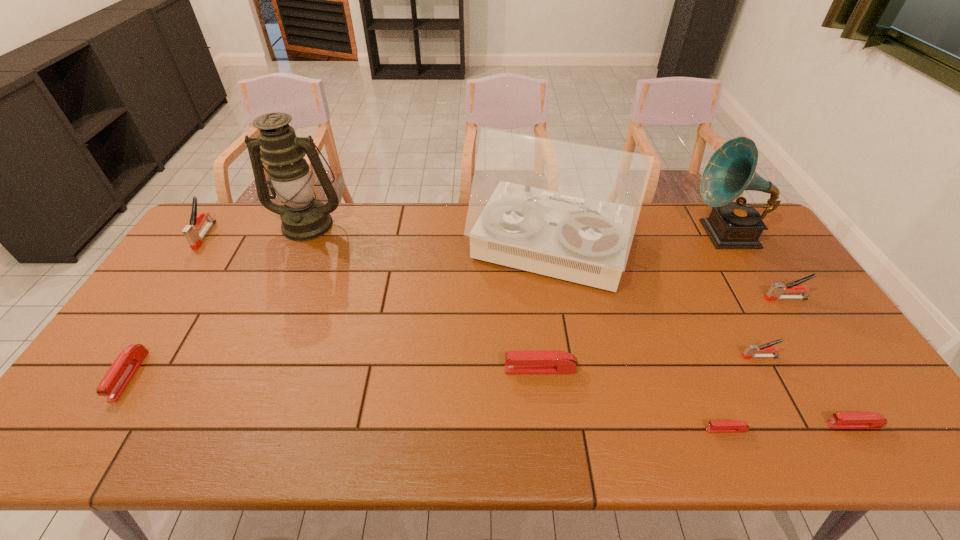
Where is `free region located 0.150m on the front-facing side of the fifth stapler from right to left`? The image size is (960, 540). free region located 0.150m on the front-facing side of the fifth stapler from right to left is located at coordinates (445, 369).

At what (x,y) coordinates should I click in order to perform the action: click on free location located 0.050m on the front-facing side of the fifth stapler from right to left. Please return your answer as a coordinate pair (x, y). This screenshot has height=540, width=960. Looking at the image, I should click on 485,369.

Identify the location of vacant space situated on the front-facing side of the third shortest stapler. Image resolution: width=960 pixels, height=540 pixels. (93, 430).

You are a GUI agent. You are given a task and a screenshot of the screen. Output one action in this format:
    pyautogui.click(x=<x>, y=<y>)
    Task: Click on the vacant region located on the front-facing side of the second shortest stapler
    This screenshot has height=540, width=960.
    Given the screenshot: What is the action you would take?
    pyautogui.click(x=702, y=424)

Locate an element on the screen. Image resolution: width=960 pixels, height=540 pixels. free region located on the front-facing side of the second shortest stapler is located at coordinates (698, 424).

Where is `vacant space located on the front-facing side of the second shortest stapler`? This screenshot has width=960, height=540. vacant space located on the front-facing side of the second shortest stapler is located at coordinates 728,424.

Identify the location of free space located 0.130m on the front-facing side of the sixth object from left to right. This screenshot has height=540, width=960. (650, 430).

You are a GUI agent. You are given a task and a screenshot of the screen. Output one action in this format:
    pyautogui.click(x=<x>, y=<y>)
    Task: Click on the vacant space located on the front-facing side of the sixth object from left to right
    Image resolution: width=960 pixels, height=540 pixels.
    Given the screenshot: What is the action you would take?
    pyautogui.click(x=641, y=430)

This screenshot has height=540, width=960. I want to click on vacant area located 0.150m on the front-facing side of the sixth object from left to right, so click(641, 430).

The height and width of the screenshot is (540, 960). Find the location of `oil lamp at the far edge`. oil lamp at the far edge is located at coordinates (303, 219).